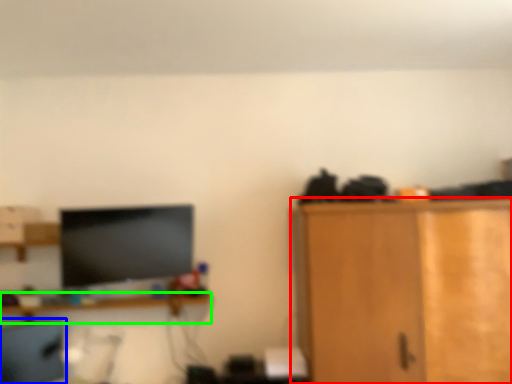
Question: Based on their relative distances, which object is nearer to cabinetry (highlighted by a red box)? Choose from computer chair (highlighted by a blue box) and shelf (highlighted by a green box).

Choices:
 (A) computer chair
 (B) shelf

Answer: (B)